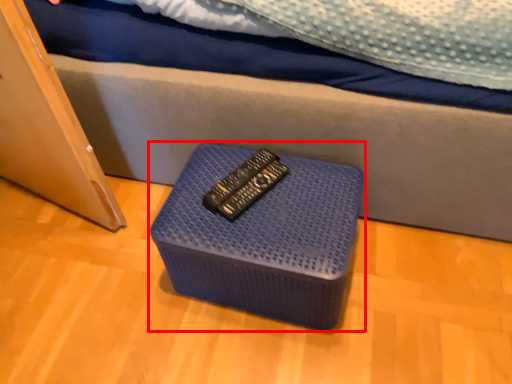
Question: Where is furniture (annotated by the red box) located in relation to remote in the image?

Choices:
 (A) right
 (B) left

Answer: (A)